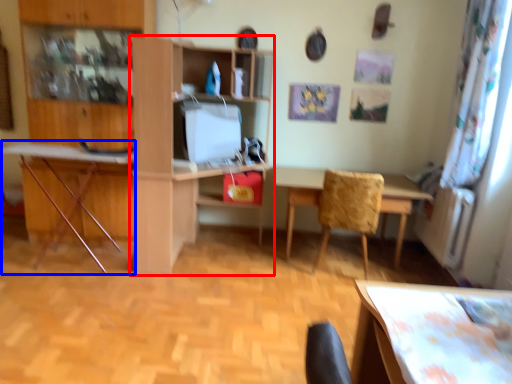
Question: Which object appears farthest to the camera in this image, shelf (highlighted by a red box) or computer desk (highlighted by a blue box)?

Choices:
 (A) shelf
 (B) computer desk

Answer: (B)